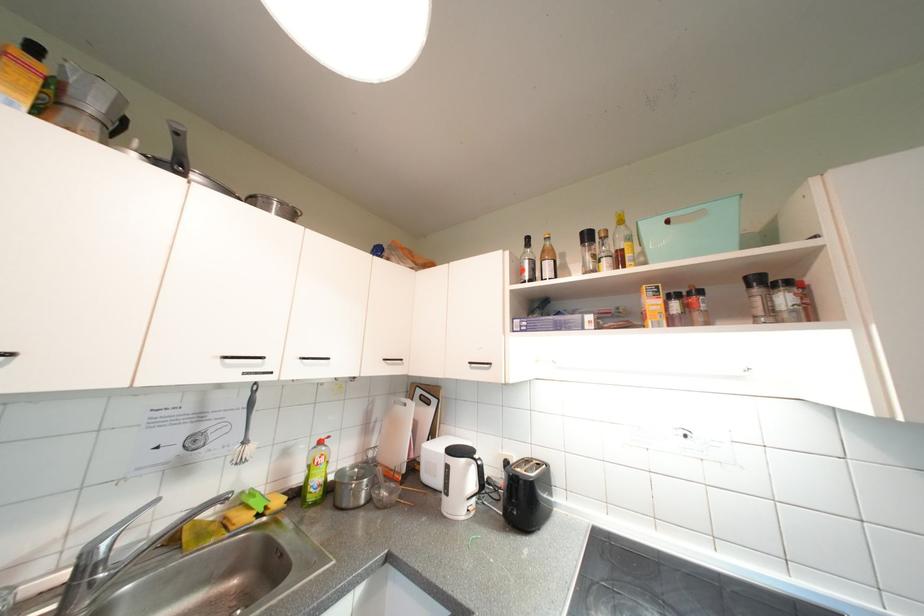
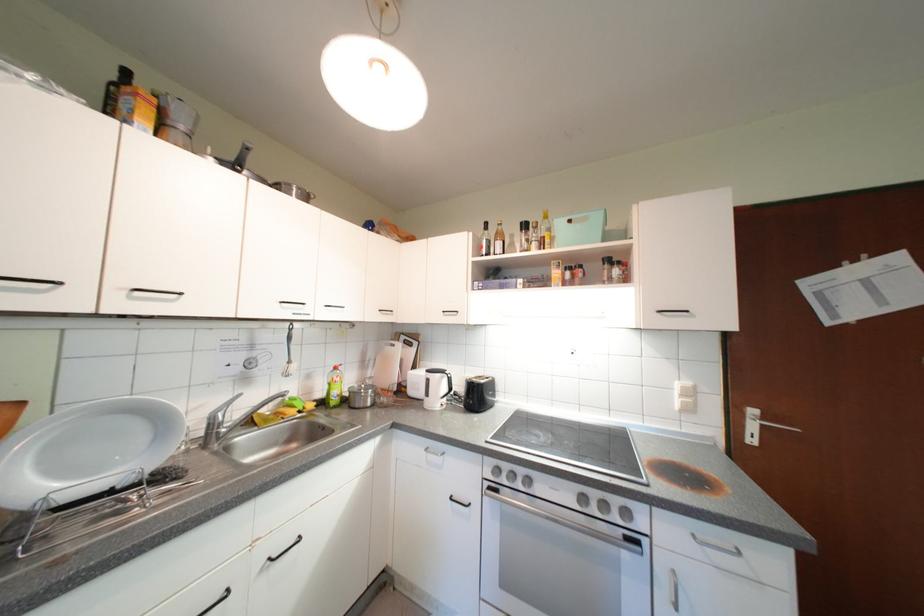
Find the pixel in the second image that matches the point at 541,272 in the first image.

(496, 249)